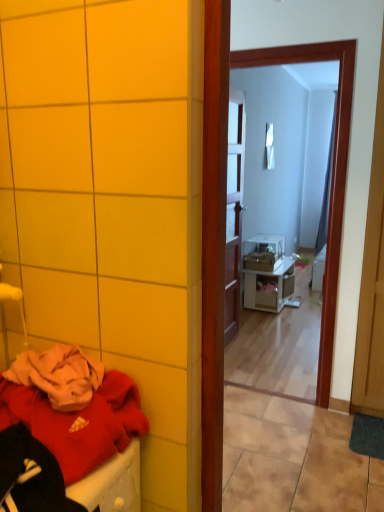
Question: Is white glossy nightstand at center wider than matte red sweater at lower left?

Choices:
 (A) yes
 (B) no

Answer: (B)

Question: From a real-world perspective, is white glossy nightstand at center under matte red sweater at lower left?

Choices:
 (A) yes
 (B) no

Answer: (A)

Question: Is white glossy nightstand at center to the left of matte red sweater at lower left from the viewer's perspective?

Choices:
 (A) no
 (B) yes

Answer: (A)

Question: Does white glossy nightstand at center have a larger size compared to matte red sweater at lower left?

Choices:
 (A) no
 (B) yes

Answer: (B)

Question: Can you confirm if white glossy nightstand at center is smaller than matte red sweater at lower left?

Choices:
 (A) no
 (B) yes

Answer: (A)

Question: In the image, is white glossy mirror at upper center, the 1th mirror positioned from the bottom, positioned in front of or behind wooden door at center?

Choices:
 (A) front
 (B) behind

Answer: (A)

Question: Is white glossy mirror at upper center, which is the 2th mirror from back to front, inside or outside of wooden door at center?

Choices:
 (A) inside
 (B) outside

Answer: (B)

Question: Would you say white glossy mirror at upper center, which is the 2th mirror in right-to-left order, is to the left or to the right of wooden door at center in the picture?

Choices:
 (A) right
 (B) left

Answer: (A)

Question: Considering the positions of white glossy mirror at upper center, acting as the 2th mirror starting from the top, and wooden door at center in the image, is white glossy mirror at upper center, acting as the 2th mirror starting from the top, bigger or smaller than wooden door at center?

Choices:
 (A) big
 (B) small

Answer: (A)

Question: Is point (273, 296) positioned closer to the camera than point (231, 312)?

Choices:
 (A) farther
 (B) closer

Answer: (A)

Question: From the image's perspective, is white glossy nightstand at center located above or below wooden door at center?

Choices:
 (A) below
 (B) above

Answer: (A)

Question: In terms of width, does white glossy nightstand at center look wider or thinner when compared to wooden door at center?

Choices:
 (A) wide
 (B) thin

Answer: (A)

Question: Would you say white glossy nightstand at center is to the left or to the right of wooden door at center in the picture?

Choices:
 (A) right
 (B) left

Answer: (A)

Question: In terms of width, does white glossy nightstand at center look wider or thinner when compared to matte red sweater at lower left?

Choices:
 (A) thin
 (B) wide

Answer: (A)

Question: Considering the positions of white glossy nightstand at center and matte red sweater at lower left in the image, is white glossy nightstand at center bigger or smaller than matte red sweater at lower left?

Choices:
 (A) big
 (B) small

Answer: (A)